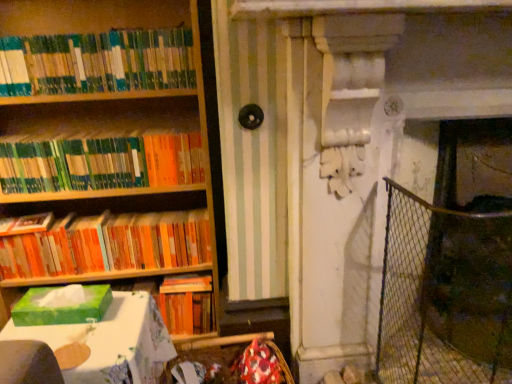
Question: Is green matte bookshelf at upper left, the third book in the bottom-to-top sequence, next to green cardboard tissue box at lower left and touching it?

Choices:
 (A) no
 (B) yes

Answer: (A)

Question: From the image's perspective, is green matte bookshelf at upper left, the 1th book in the top-to-bottom sequence, over green cardboard tissue box at lower left?

Choices:
 (A) no
 (B) yes

Answer: (B)

Question: Is green matte bookshelf at upper left, the third book in the bottom-to-top sequence, bigger than green cardboard tissue box at lower left?

Choices:
 (A) no
 (B) yes

Answer: (A)

Question: Can we say green matte bookshelf at upper left, the third book in the bottom-to-top sequence, lies outside green cardboard tissue box at lower left?

Choices:
 (A) yes
 (B) no

Answer: (A)

Question: Could you tell me if green matte bookshelf at upper left, the third book in the bottom-to-top sequence, is facing green cardboard tissue box at lower left?

Choices:
 (A) yes
 (B) no

Answer: (B)

Question: Does green matte bookshelf at upper left, the third book in the bottom-to-top sequence, lie behind green cardboard tissue box at lower left?

Choices:
 (A) no
 (B) yes

Answer: (B)

Question: Considering the relative sizes of wire mesh fence at right and green matte bookshelf at upper left, the 1th book in the top-to-bottom sequence, in the image provided, is wire mesh fence at right thinner than green matte bookshelf at upper left, the 1th book in the top-to-bottom sequence,?

Choices:
 (A) yes
 (B) no

Answer: (B)

Question: Is wire mesh fence at right positioned in front of green matte bookshelf at upper left, the 1th book in the top-to-bottom sequence?

Choices:
 (A) yes
 (B) no

Answer: (B)

Question: Is wire mesh fence at right to the right of green matte bookshelf at upper left, the 1th book in the top-to-bottom sequence, from the viewer's perspective?

Choices:
 (A) no
 (B) yes

Answer: (B)

Question: Does wire mesh fence at right have a greater width compared to green matte bookshelf at upper left, the third book in the bottom-to-top sequence?

Choices:
 (A) yes
 (B) no

Answer: (A)

Question: Is wire mesh fence at right bigger than green matte bookshelf at upper left, the third book in the bottom-to-top sequence?

Choices:
 (A) no
 (B) yes

Answer: (B)

Question: From the image's perspective, is wire mesh fence at right located beneath green matte bookshelf at upper left, the 1th book in the top-to-bottom sequence?

Choices:
 (A) no
 (B) yes

Answer: (B)

Question: Is green cardboard tissue box at lower left facing away from green matte tissue box at left?

Choices:
 (A) no
 (B) yes

Answer: (A)